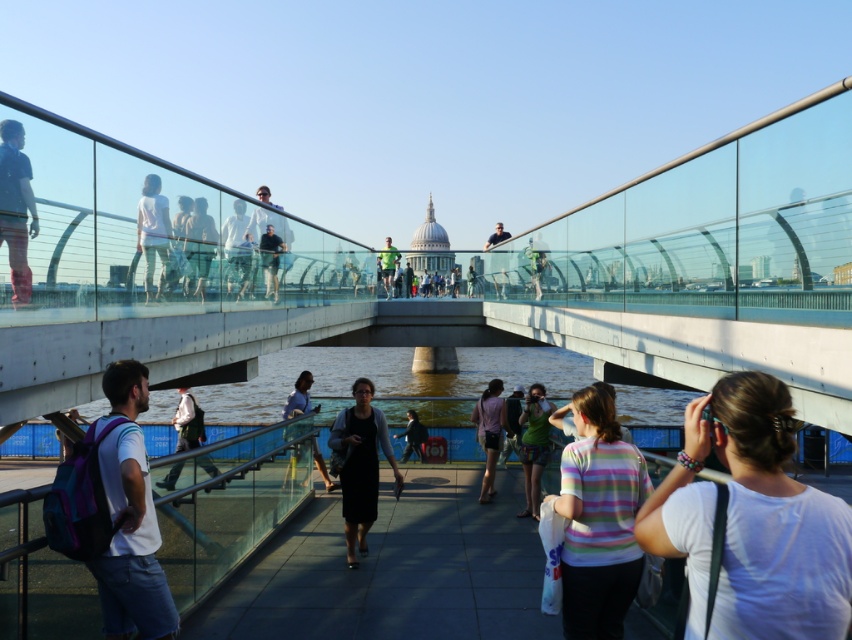
You are standing on the pedestrian bridge and notice the smooth concrete pavement at center and the green fabric dress at center. Which object is closer to the water below?

The smooth concrete pavement at center is positioned under the green fabric dress at center, so the smooth concrete pavement at center is closer to the water below.

You are standing on the pedestrian bridge and notice the smooth concrete pavement at center and the white matte shirt at upper center. Which object is closer to the ground?

The smooth concrete pavement at center is positioned under the white matte shirt at upper center, so the smooth concrete pavement at center is closer to the ground.

You are standing on the pedestrian bridge and want to take a photo of the green fabric dress at center. To avoid including the smooth concrete pavement at center in your photo, should you move to the left or right of the dress?

The smooth concrete pavement at center is positioned on the left side of the green fabric dress at center, so to avoid including it in your photo, you should move to the left of the dress.